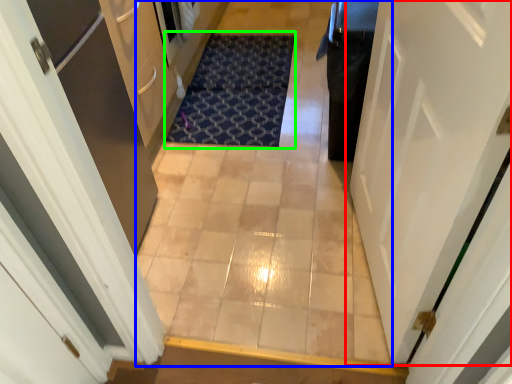
Question: Based on their relative distances, which object is farther from door (highlighted by a red box)? Choose from corridor (highlighted by a blue box) and doormat (highlighted by a green box).

Choices:
 (A) corridor
 (B) doormat

Answer: (B)